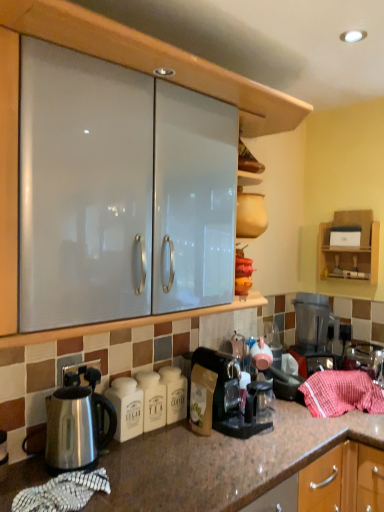
Question: From a real-world perspective, is red striped cloth at lower right above or below white ceramic sugar container at lower left?

Choices:
 (A) below
 (B) above

Answer: (A)

Question: In terms of height, does red striped cloth at lower right look taller or shorter compared to white ceramic sugar container at lower left?

Choices:
 (A) short
 (B) tall

Answer: (A)

Question: Which of these objects is positioned farthest from the stainless steel kettle at lower left?

Choices:
 (A) black plastic coffee maker at right, which is the first coffee maker in back-to-front order
 (B) transparent plastic coffee maker at lower center, the 2th coffee maker from the right
 (C) white ceramic sugar container at lower left
 (D) red striped cloth at lower right
 (E) wooden shelf at upper right

Answer: (E)

Question: Which object is the farthest from the stainless steel kettle at lower left?

Choices:
 (A) wooden shelf at upper right
 (B) transparent plastic coffee maker at lower center, the first coffee maker from the front
 (C) red striped cloth at lower right
 (D) black plastic coffee maker at right, which is the first coffee maker in back-to-front order
 (E) white ceramic sugar container at lower left

Answer: (A)